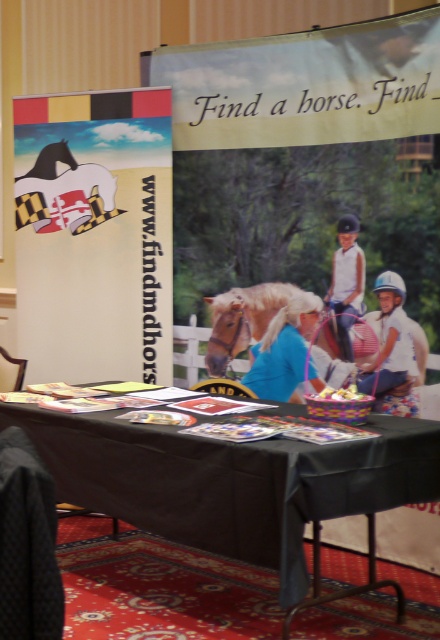
Is white helmet at center closer to the viewer compared to white cotton shirt at center?

Yes, white helmet at center is closer to the viewer.

Can you confirm if white helmet at center is positioned below white cotton shirt at center?

Indeed, white helmet at center is positioned under white cotton shirt at center.

The width and height of the screenshot is (440, 640). What do you see at coordinates (396, 346) in the screenshot?
I see `white helmet at center` at bounding box center [396, 346].

The image size is (440, 640). Find the location of `white helmet at center`. white helmet at center is located at coordinates (396, 346).

Which is more to the right, white helmet at center or blonde mane horse at center?

Positioned to the right is white helmet at center.

Between white helmet at center and blonde mane horse at center, which one is positioned lower?

white helmet at center is below.

What do you see at coordinates (396, 346) in the screenshot? Image resolution: width=440 pixels, height=640 pixels. I see `white helmet at center` at bounding box center [396, 346].

The image size is (440, 640). In order to click on white helmet at center in this screenshot , I will do `click(396, 346)`.

Does black fabric table at center have a greater height compared to blonde mane horse at center?

Correct, black fabric table at center is much taller as blonde mane horse at center.

Does black fabric table at center have a greater width compared to blonde mane horse at center?

Indeed, black fabric table at center has a greater width compared to blonde mane horse at center.

Locate an element on the screen. This screenshot has width=440, height=640. black fabric table at center is located at coordinates (231, 481).

The height and width of the screenshot is (640, 440). Identify the location of black fabric table at center. (231, 481).